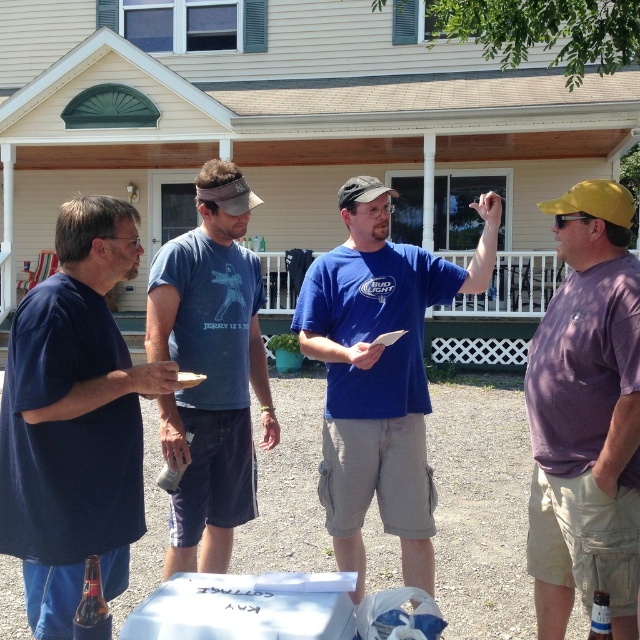
From the picture: Which is above, purple cotton shirt at right or matte plastic cup at center?

matte plastic cup at center is higher up.

Consider the image. Does purple cotton shirt at right appear on the left side of matte plastic cup at center?

In fact, purple cotton shirt at right is to the right of matte plastic cup at center.

Does point (608, 477) lie behind point (189, 374)?

No.

In order to click on purple cotton shirt at right in this screenshot , I will do `click(586, 416)`.

Which is in front, point (141, 488) or point (333, 460)?

Positioned in front is point (141, 488).

Can you confirm if dark blue t-shirt at left is thinner than blue cotton shirt at center?

Yes.

Find the location of a particular element. dark blue t-shirt at left is located at coordinates (74, 419).

What are the coordinates of `dark blue t-shirt at left` in the screenshot? It's located at (74, 419).

Does purple cotton shirt at right lie in front of blue cotton shirt at center?

Yes, purple cotton shirt at right is closer to the viewer.

Where is `purple cotton shirt at right`? Image resolution: width=640 pixels, height=640 pixels. purple cotton shirt at right is located at coordinates (586, 416).

Between point (602, 420) and point (371, 262), which one is positioned in front?

Point (602, 420)

Identify the location of purple cotton shirt at right. (586, 416).